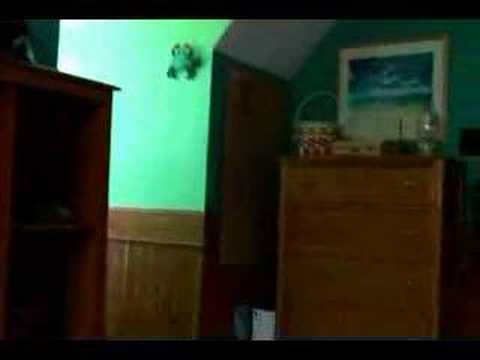
You are a GUI agent. You are given a task and a screenshot of the screen. Output one action in this format:
    pyautogui.click(x=<x>, y=<y>)
    Task: Click on the basket
    Image resolution: width=480 pixels, height=360 pixels.
    Given the screenshot: What is the action you would take?
    pyautogui.click(x=314, y=129)